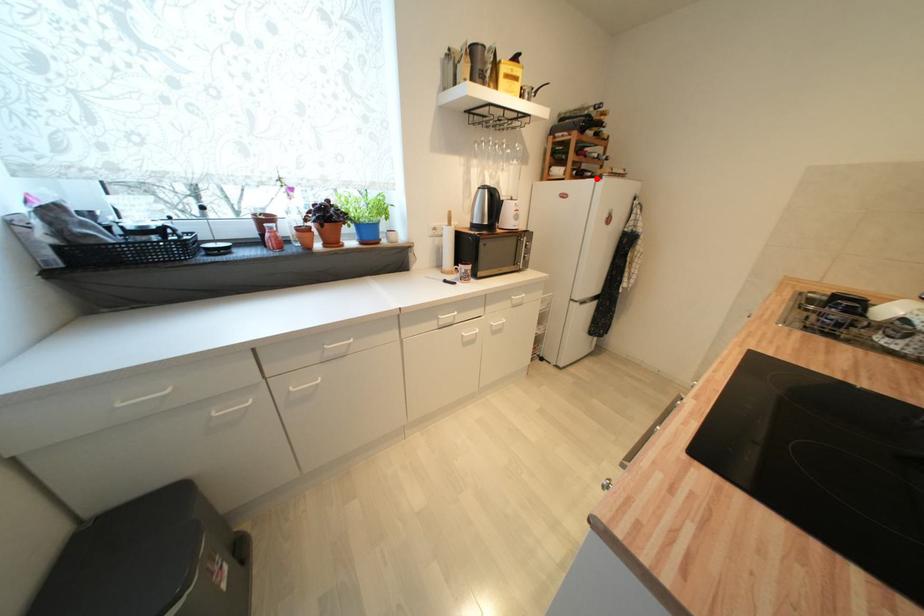
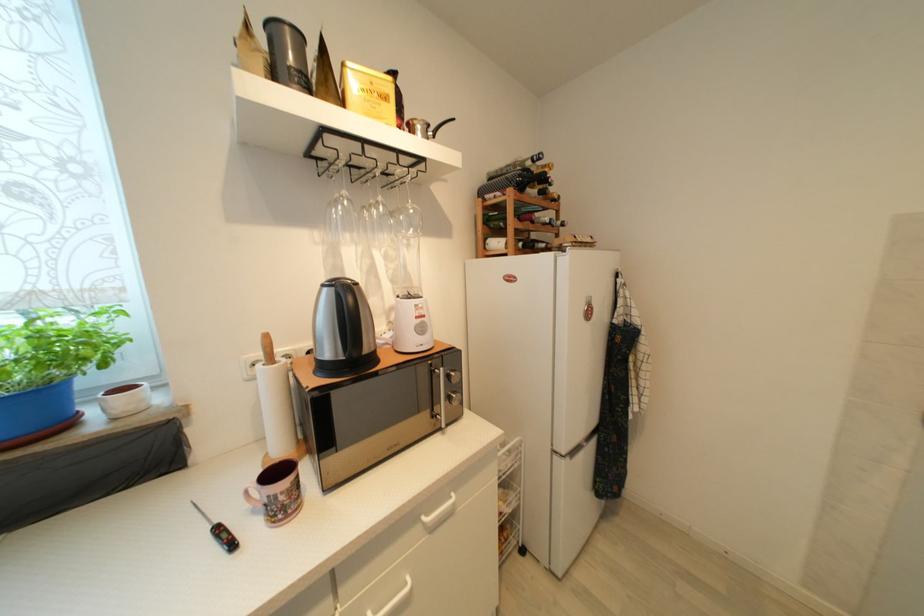
Find the pixel in the second image that matches the highlighted location in the first image.

(553, 251)